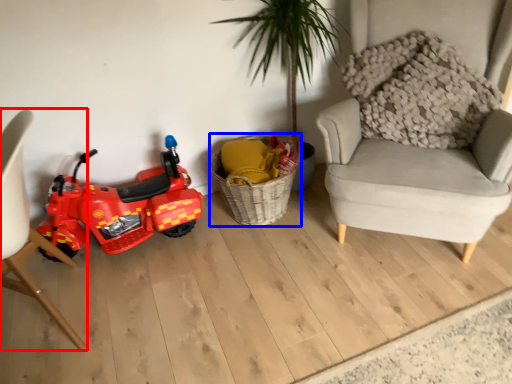
Question: Among these objects, which one is farthest to the camera, chair (highlighted by a red box) or basket (highlighted by a blue box)?

Choices:
 (A) chair
 (B) basket

Answer: (B)